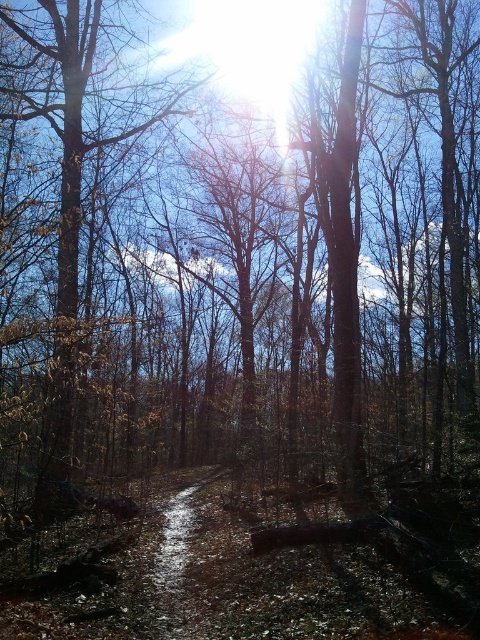
Question: Does brown wood tree at center have a larger size compared to damp dirt trail at center?

Choices:
 (A) yes
 (B) no

Answer: (A)

Question: Which point appears closest to the camera in this image?

Choices:
 (A) (200, 636)
 (B) (54, 483)

Answer: (A)

Question: Does brown wood tree at center appear on the left side of damp dirt trail at center?

Choices:
 (A) no
 (B) yes

Answer: (B)

Question: Among these objects, which one is farthest from the camera?

Choices:
 (A) brown wood tree at center
 (B) damp dirt trail at center

Answer: (B)

Question: Does brown wood tree at center have a smaller size compared to damp dirt trail at center?

Choices:
 (A) yes
 (B) no

Answer: (B)